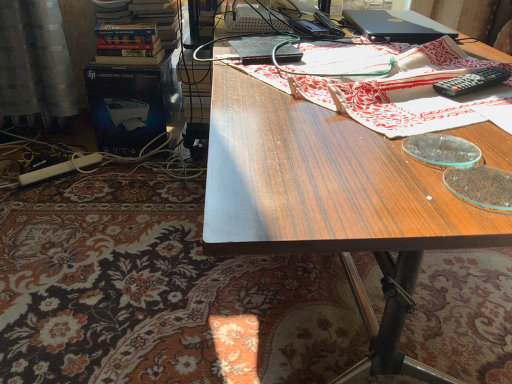
Find the location of `vacant space to the left of black plastic remote control at upper right`. vacant space to the left of black plastic remote control at upper right is located at coordinates (385, 97).